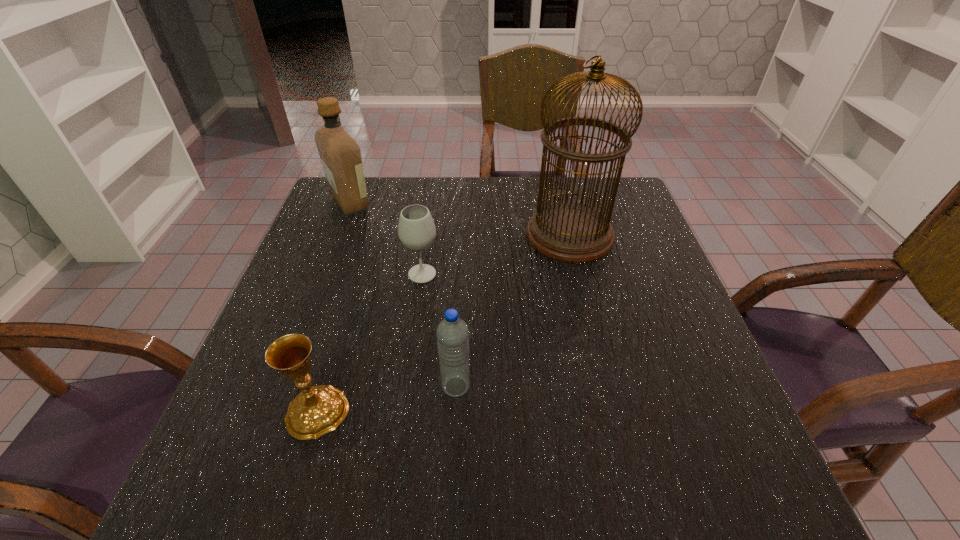
The image size is (960, 540). In order to click on vacant space at the far edge in this screenshot , I will do `click(380, 214)`.

Locate an element on the screen. The height and width of the screenshot is (540, 960). vacant space at the near edge of the desktop is located at coordinates (456, 501).

Identify the location of blank space at the left edge of the desktop. The height and width of the screenshot is (540, 960). (224, 454).

This screenshot has width=960, height=540. In order to click on vacant region at the right edge of the desktop in this screenshot , I will do `click(675, 289)`.

Identify the location of blank space at the far right corner of the desktop. (632, 221).

Find the location of `empty space between the fourth object from left to right and the chalice`. empty space between the fourth object from left to right and the chalice is located at coordinates (387, 399).

The height and width of the screenshot is (540, 960). What are the coordinates of `vacant area that lies between the chalice and the liquor` in the screenshot? It's located at coord(334,307).

You are a GUI agent. You are given a task and a screenshot of the screen. Output one action in this format:
    pyautogui.click(x=<x>, y=<y>)
    Task: Click on the free point between the second object from right to left and the chalice
    
    Given the screenshot: What is the action you would take?
    click(387, 399)

Locate an element on the screen. The width and height of the screenshot is (960, 540). empty space that is in between the water bottle and the liquor is located at coordinates (403, 295).

At what (x,y) coordinates should I click in order to perform the action: click on empty location between the birdcage and the fourth object from left to right. Please return your answer as a coordinate pair (x, y). Looking at the image, I should click on (513, 310).